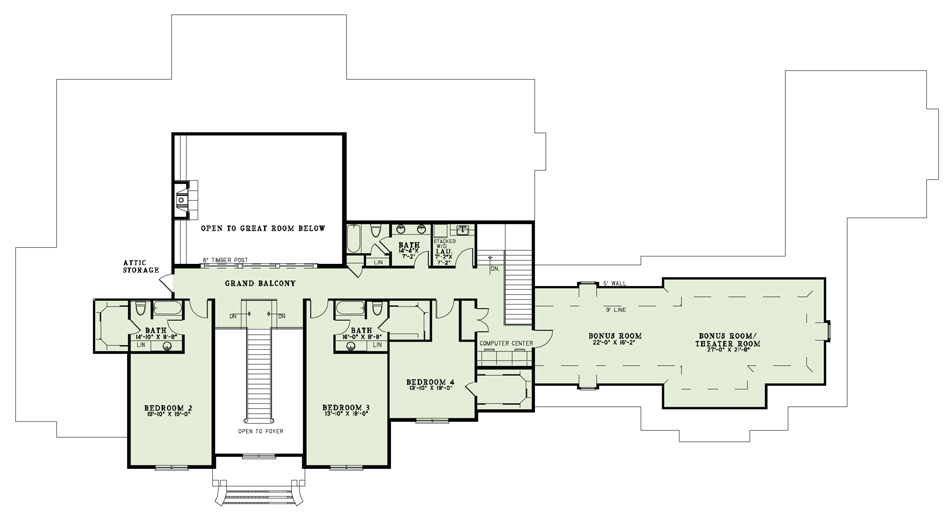
Identify the location of bathroom. This screenshot has height=517, width=950. (152, 322), (401, 239), (362, 330).